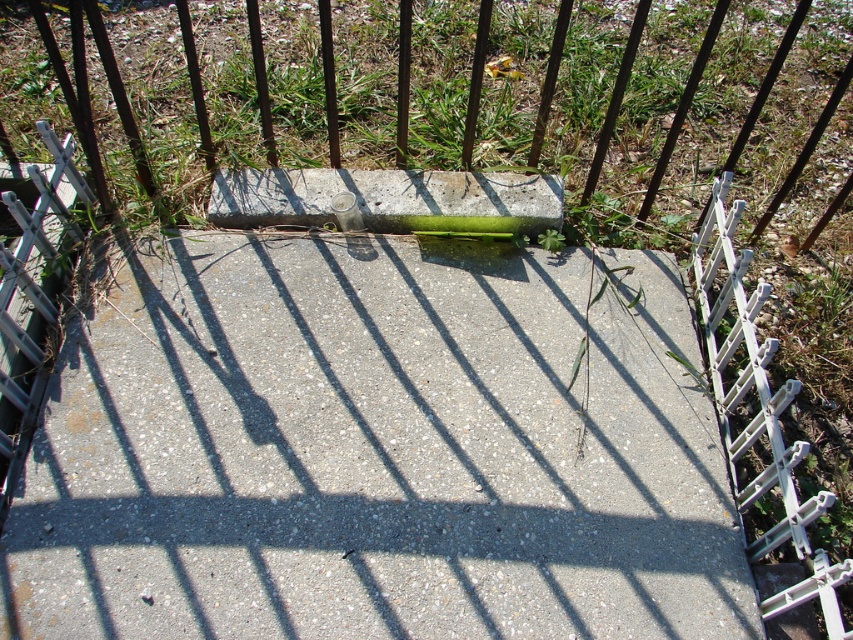
Question: Which of the following is the closest to the observer?

Choices:
 (A) concreteroughconcrete block at center
 (B) white plastic rail at right
 (C) gray concrete at center

Answer: (B)

Question: Is white plastic rail at right above concreteroughconcrete block at center?

Choices:
 (A) yes
 (B) no

Answer: (B)

Question: Does green grass at center appear on the right side of white plastic rail at right?

Choices:
 (A) yes
 (B) no

Answer: (B)

Question: Is gray concrete at center to the right of concreteroughconcrete block at center from the viewer's perspective?

Choices:
 (A) no
 (B) yes

Answer: (B)

Question: Which of the following is the farthest from the observer?

Choices:
 (A) green grass at center
 (B) gray concrete at center
 (C) concreteroughconcrete block at center

Answer: (C)

Question: Among these points, which one is nearest to the camera?

Choices:
 (A) (286, 260)
 (B) (267, 218)
 (C) (773, 401)
 (D) (350, 68)

Answer: (C)